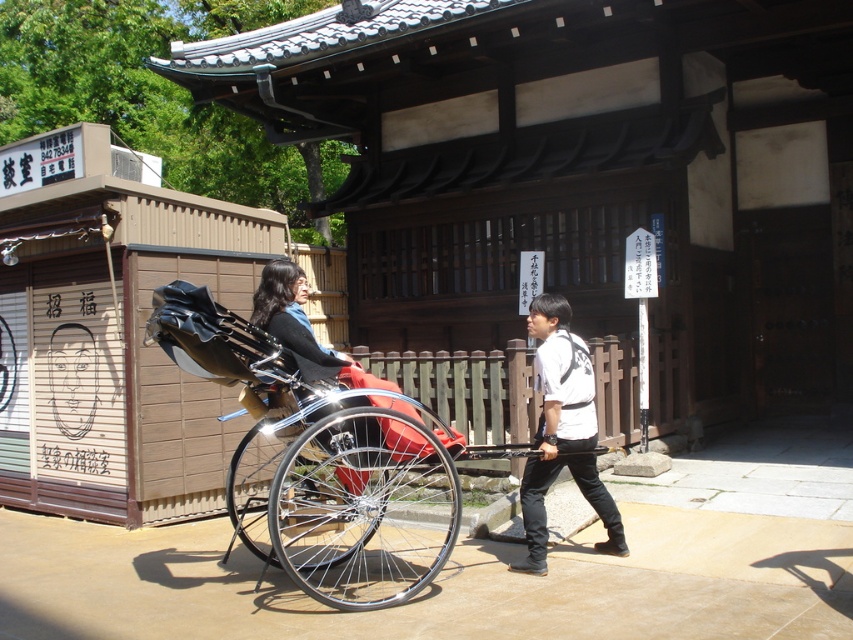
Question: Does shiny chrome rickshaw at center have a lesser width compared to matte black rickshaw at center?

Choices:
 (A) no
 (B) yes

Answer: (A)

Question: Which of the following is the farthest from the observer?

Choices:
 (A) (263, 284)
 (B) (576, 461)
 (C) (236, 529)

Answer: (B)

Question: In this image, where is shiny chrome rickshaw at center located relative to white matte shirt at center?

Choices:
 (A) below
 (B) above

Answer: (A)

Question: Which of the following is the farthest from the observer?

Choices:
 (A) white matte shirt at center
 (B) shiny chrome rickshaw at center
 (C) matte black rickshaw at center

Answer: (A)

Question: Which object is positioned closest to the shiny chrome rickshaw at center?

Choices:
 (A) white matte shirt at center
 (B) matte black rickshaw at center

Answer: (B)

Question: Is the position of white matte shirt at center less distant than that of matte black rickshaw at center?

Choices:
 (A) yes
 (B) no

Answer: (B)